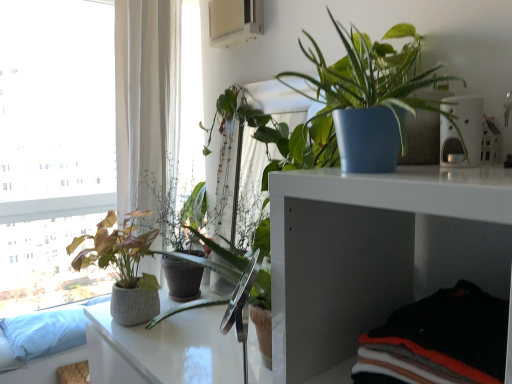
Identify the location of vacant area on top of blue fabric couch at lower left (from a real-world perspective). (52, 313).